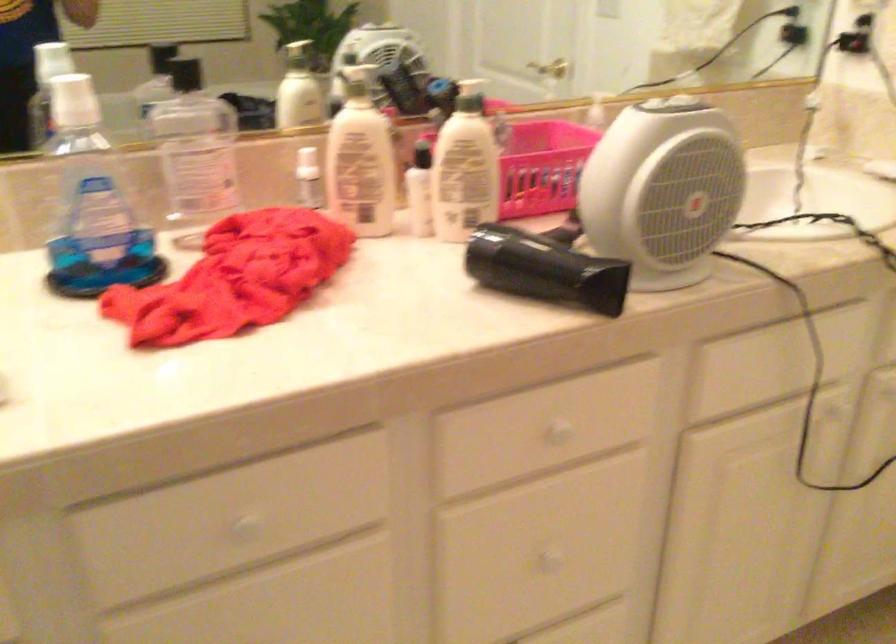
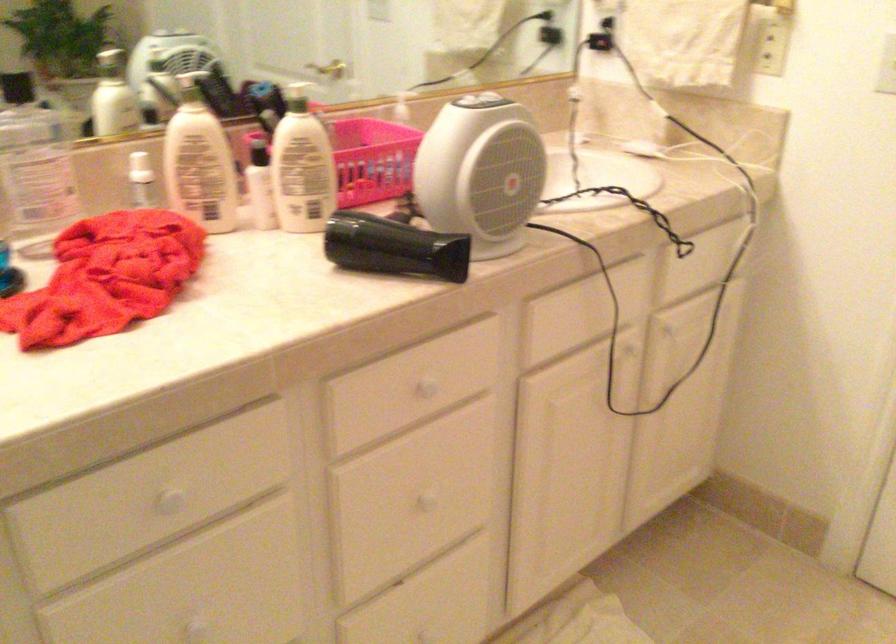
The point at (544, 268) is marked in the first image. Where is the corresponding point in the second image?

(393, 247)